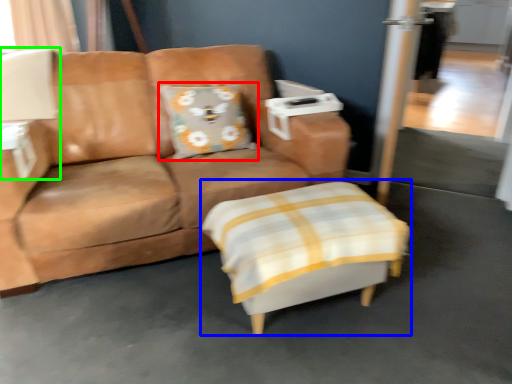
Question: Which is farther away from pillow (highlighted by a red box)? swivel chair (highlighted by a blue box) or table lamp (highlighted by a green box)?

Choices:
 (A) swivel chair
 (B) table lamp

Answer: (A)